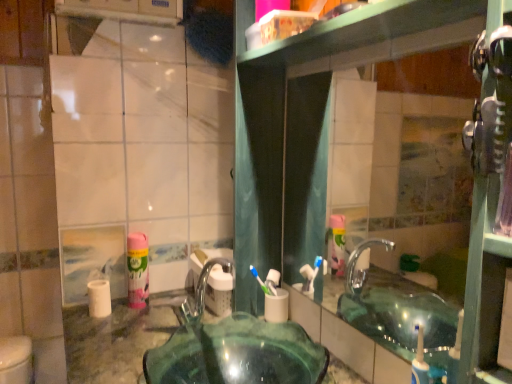
Question: From a real-world perspective, is transparent glass sink at center located higher than clear glass mirror at upper center?

Choices:
 (A) no
 (B) yes

Answer: (A)

Question: Is transparent glass sink at center facing away from clear glass mirror at upper center?

Choices:
 (A) yes
 (B) no

Answer: (B)

Question: Would you say transparent glass sink at center is a long distance from clear glass mirror at upper center?

Choices:
 (A) no
 (B) yes

Answer: (A)

Question: Does transparent glass sink at center have a lesser width compared to clear glass mirror at upper center?

Choices:
 (A) no
 (B) yes

Answer: (A)

Question: Is transparent glass sink at center next to clear glass mirror at upper center?

Choices:
 (A) no
 (B) yes

Answer: (A)

Question: Considering the positions of clear glass mirror at upper center and white matte toilet paper at center, placed as the first toilet paper when sorted from right to left, in the image, is clear glass mirror at upper center wider or thinner than white matte toilet paper at center, placed as the first toilet paper when sorted from right to left,?

Choices:
 (A) wide
 (B) thin

Answer: (B)

Question: Is clear glass mirror at upper center in front of or behind white matte toilet paper at center, placed as the first toilet paper when sorted from right to left, in the image?

Choices:
 (A) front
 (B) behind

Answer: (A)

Question: Based on their positions, is clear glass mirror at upper center located to the left or right of white matte toilet paper at center, placed as the first toilet paper when sorted from right to left?

Choices:
 (A) right
 (B) left

Answer: (A)

Question: Is clear glass mirror at upper center inside the boundaries of white matte toilet paper at center, placed as the first toilet paper when sorted from right to left, or outside?

Choices:
 (A) outside
 (B) inside

Answer: (A)

Question: Considering the positions of point (419, 137) and point (102, 316), is point (419, 137) closer or farther from the camera than point (102, 316)?

Choices:
 (A) farther
 (B) closer

Answer: (A)

Question: From their relative heights in the image, would you say clear glass mirror at upper center is taller or shorter than white matte toilet paper at left, which ranks as the 1th toilet paper in left-to-right order?

Choices:
 (A) tall
 (B) short

Answer: (A)

Question: Is clear glass mirror at upper center situated inside white matte toilet paper at left, which ranks as the 1th toilet paper in left-to-right order, or outside?

Choices:
 (A) inside
 (B) outside

Answer: (B)

Question: In the image, is clear glass mirror at upper center on the left side or the right side of white matte toilet paper at left, which is the second toilet paper from right to left?

Choices:
 (A) left
 (B) right

Answer: (B)

Question: Based on their positions, is pink matte mouthwash at left located to the left or right of transparent glass sink at center?

Choices:
 (A) right
 (B) left

Answer: (B)

Question: Considering the positions of pink matte mouthwash at left and transparent glass sink at center in the image, is pink matte mouthwash at left bigger or smaller than transparent glass sink at center?

Choices:
 (A) big
 (B) small

Answer: (B)